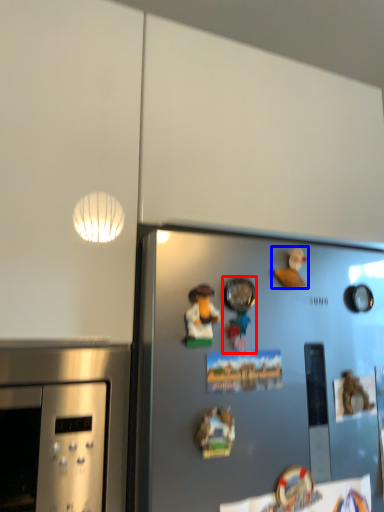
Question: Among these objects, which one is nearest to the camera, toy (highlighted by a red box) or toy (highlighted by a blue box)?

Choices:
 (A) toy
 (B) toy

Answer: (A)